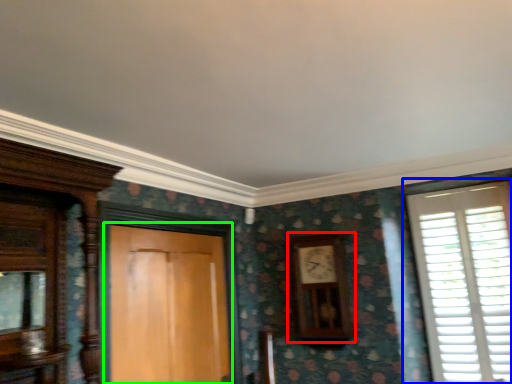
Question: Which object is the closest to the clock (highlighted by a red box)? Choose among these: window (highlighted by a blue box) or door (highlighted by a green box).

Choices:
 (A) window
 (B) door

Answer: (A)